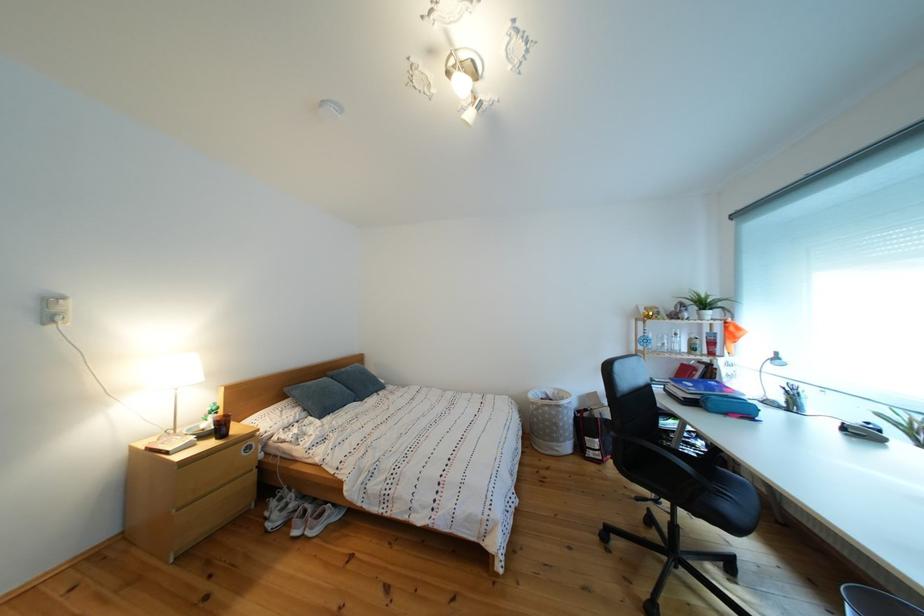
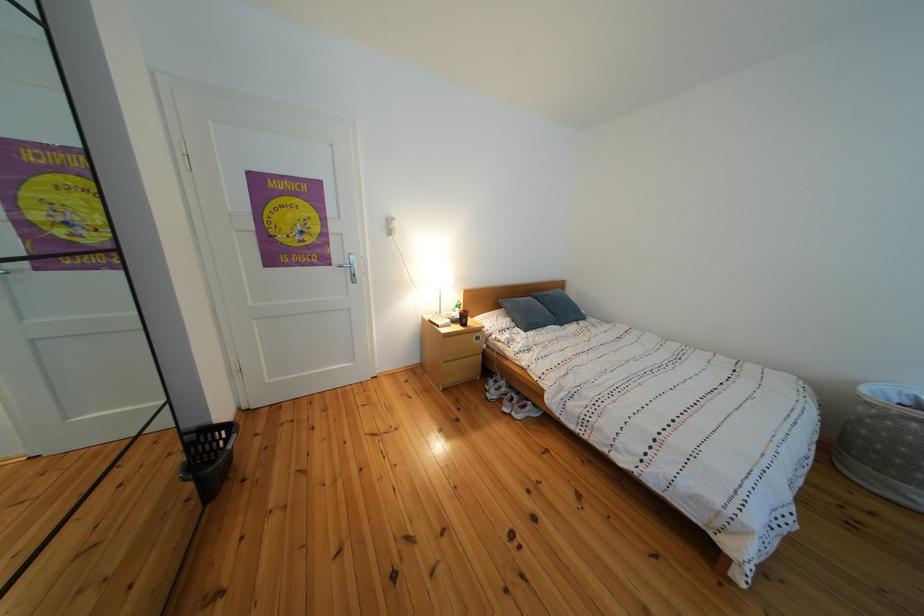
The point at (285, 508) is marked in the first image. Where is the corresponding point in the second image?

(503, 387)